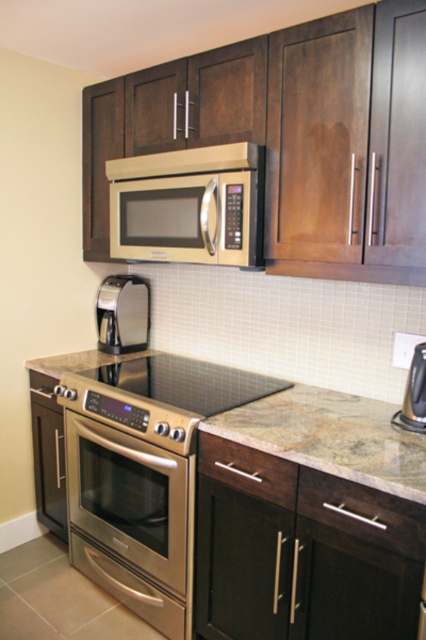
Question: Among these points, which one is farthest from the camera?

Choices:
 (A) (149, 392)
 (B) (109, 333)

Answer: (B)

Question: Among these objects, which one is farthest from the camera?

Choices:
 (A) satin nickel coffee maker at center
 (B) satin gold microwave at upper center

Answer: (A)

Question: Can you confirm if stainless steel stove at center is positioned above matte stainless steel microwave at upper center?

Choices:
 (A) no
 (B) yes

Answer: (A)

Question: Does stainless steel stove at center have a greater width compared to matte stainless steel microwave at upper center?

Choices:
 (A) yes
 (B) no

Answer: (A)

Question: Is marble/granite countertop at center in front of matte stainless steel microwave at upper center?

Choices:
 (A) no
 (B) yes

Answer: (B)

Question: Which point is closer to the camera?

Choices:
 (A) satin nickel coffee maker at center
 (B) satin black coffee maker at center
 (C) marble/granite countertop at center

Answer: (C)